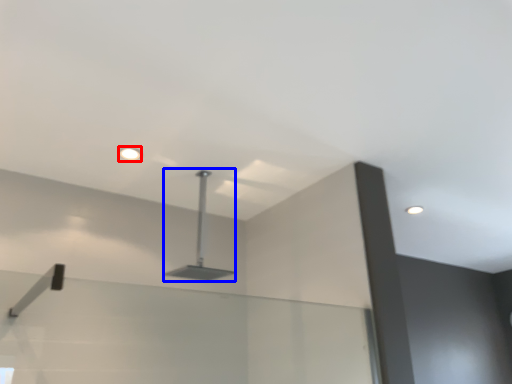
Question: Which point is further to the camera, droplight (highlighted by a red box) or lamp (highlighted by a blue box)?

Choices:
 (A) droplight
 (B) lamp

Answer: (A)